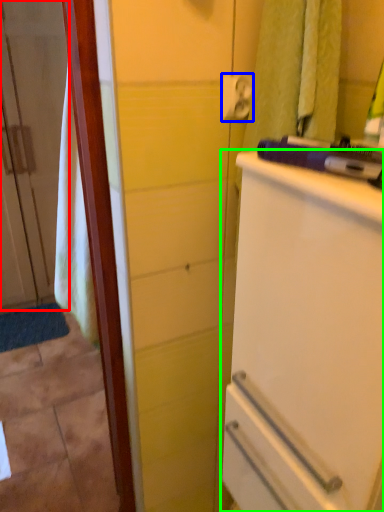
Question: Which is nearer to the door (highlighted by a red box)? towel bar (highlighted by a blue box) or refrigerator (highlighted by a green box).

Choices:
 (A) towel bar
 (B) refrigerator

Answer: (A)